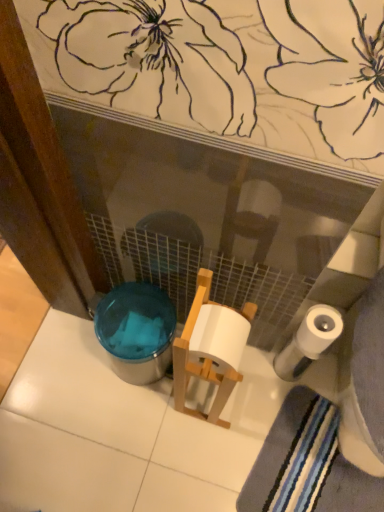
Question: Does point (145, 353) appear closer or farther from the camera than point (357, 494)?

Choices:
 (A) farther
 (B) closer

Answer: (B)

Question: Considering the relative positions of translucent plastic potty at lower left and striped cotton bath towel at lower right in the image provided, is translucent plastic potty at lower left to the left or to the right of striped cotton bath towel at lower right?

Choices:
 (A) right
 (B) left

Answer: (B)

Question: Which is nearer to the white matte toilet paper at lower right?

Choices:
 (A) translucent plastic potty at lower left
 (B) striped cotton bath towel at lower right

Answer: (B)

Question: Which object is positioned farthest from the translucent plastic potty at lower left?

Choices:
 (A) striped cotton bath towel at lower right
 (B) white matte toilet paper at lower right

Answer: (A)